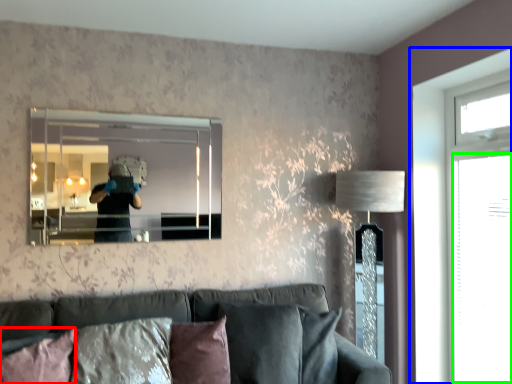
Question: Considering the real-world distances, which object is closest to pillow (highlighted by a red box)? window (highlighted by a blue box) or glass door (highlighted by a green box).

Choices:
 (A) window
 (B) glass door

Answer: (A)